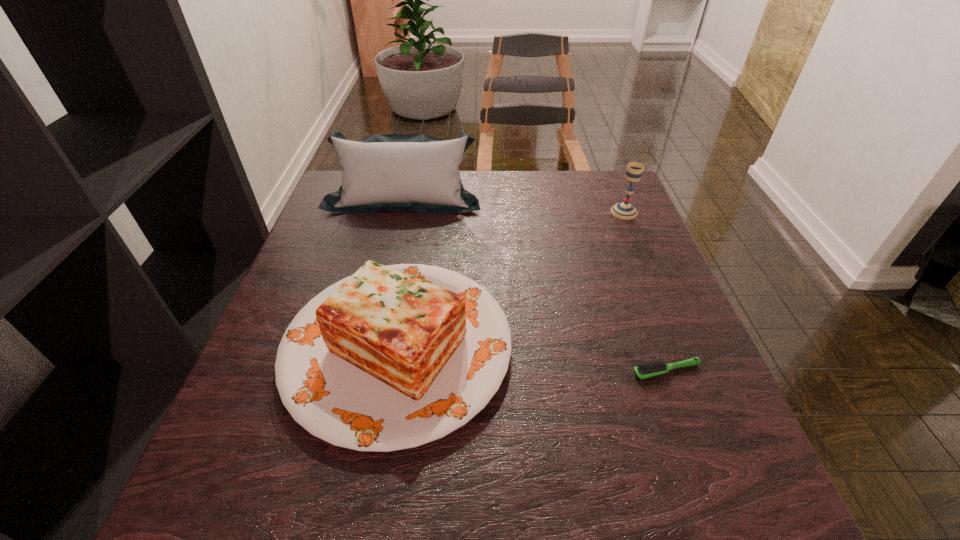
You are a GUI agent. You are given a task and a screenshot of the screen. Output one action in this format:
    pyautogui.click(x=<x>, y=<y>)
    Task: Click on the object identified as the third closest to the cushion
    The image size is (960, 540).
    Given the screenshot: What is the action you would take?
    pyautogui.click(x=652, y=369)

Where is `object that is the third closest to the chalice`? object that is the third closest to the chalice is located at coordinates (652, 369).

Locate an element on the screen. vacant space that satisfies the following two spatial constraints: 1. on the back side of the chalice; 2. on the right side of the shortest object is located at coordinates (608, 212).

Where is `free point that satisfies the following two spatial constraints: 1. on the surface of the cushion; 2. on the left side of the hairbrush`? The width and height of the screenshot is (960, 540). free point that satisfies the following two spatial constraints: 1. on the surface of the cushion; 2. on the left side of the hairbrush is located at coordinates click(x=364, y=370).

Find the location of a particular element. This screenshot has width=960, height=540. vacant space that satisfies the following two spatial constraints: 1. on the surface of the chalice; 2. on the right side of the tallest object is located at coordinates (400, 212).

This screenshot has height=540, width=960. Identify the location of vacant space that satisfies the following two spatial constraints: 1. on the surface of the chalice; 2. on the left side of the tallest object. pyautogui.click(x=400, y=212).

This screenshot has height=540, width=960. What are the coordinates of `free region that satisfies the following two spatial constraints: 1. on the surface of the tallest object; 2. on the right side of the hairbrush` in the screenshot? It's located at (364, 370).

You are a GUI agent. You are given a task and a screenshot of the screen. Output one action in this format:
    pyautogui.click(x=<x>, y=<y>)
    Task: Click on the vacant space that satisfies the following two spatial constraints: 1. on the surface of the cushion; 2. on the left side of the chalice
    
    Given the screenshot: What is the action you would take?
    pyautogui.click(x=400, y=212)

In order to click on vacant area that satisfies the following two spatial constraints: 1. on the back side of the hairbrush; 2. on the right side of the chalice in this screenshot , I will do `click(608, 212)`.